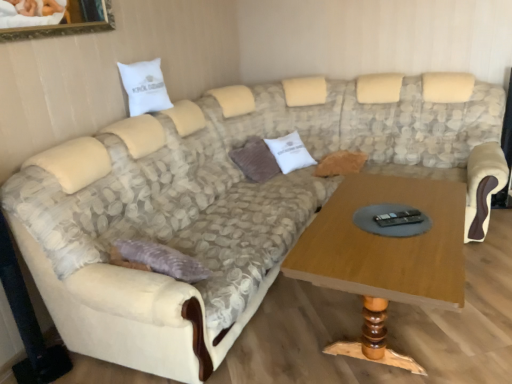
Where is `brown corduroy pillow at center, the second pillow viewed from the left`? This screenshot has width=512, height=384. brown corduroy pillow at center, the second pillow viewed from the left is located at coordinates (255, 160).

This screenshot has width=512, height=384. Describe the element at coordinates (290, 152) in the screenshot. I see `white cotton pillow at center, acting as the third pillow starting from the left` at that location.

The height and width of the screenshot is (384, 512). I want to click on brown corduroy pillow at center, which is the 2th pillow from right to left, so click(255, 160).

Is wooden coffee table at center facing away from white cotton pillow at upper left, the 1th pillow in the left-to-right sequence?

No, white cotton pillow at upper left, the 1th pillow in the left-to-right sequence, is not at the back of wooden coffee table at center.

From a real-world perspective, does wooden coffee table at center sit lower than white cotton pillow at upper left, the 1th pillow in the left-to-right sequence?

Yes, from a real-world perspective, wooden coffee table at center is below white cotton pillow at upper left, the 1th pillow in the left-to-right sequence.

Is point (446, 200) behind point (120, 72)?

No, (446, 200) is in front of (120, 72).

From the picture: Is brown corduroy pillow at center, the second pillow viewed from the left, to the left of wooden coffee table at center from the viewer's perspective?

Yes, brown corduroy pillow at center, the second pillow viewed from the left, is to the left of wooden coffee table at center.

Consider the image. Are brown corduroy pillow at center, which is the 2th pillow from right to left, and wooden coffee table at center located far from each other?

brown corduroy pillow at center, which is the 2th pillow from right to left, is positioned a significant distance from wooden coffee table at center.

Which is in front, brown corduroy pillow at center, the second pillow viewed from the left, or wooden coffee table at center?

wooden coffee table at center is more forward.

Can you confirm if brown corduroy pillow at center, the second pillow viewed from the left, is smaller than wooden coffee table at center?

Yes.

In terms of width, does white cotton pillow at center, which ranks as the first pillow in right-to-left order, look wider or thinner when compared to wooden coffee table at center?

In the image, white cotton pillow at center, which ranks as the first pillow in right-to-left order, appears to be more narrow than wooden coffee table at center.

Does white cotton pillow at center, which ranks as the first pillow in right-to-left order, touch wooden coffee table at center?

No, white cotton pillow at center, which ranks as the first pillow in right-to-left order, is not with wooden coffee table at center.

Which object is further away from the camera, white cotton pillow at center, acting as the third pillow starting from the left, or wooden coffee table at center?

white cotton pillow at center, acting as the third pillow starting from the left, is further from the camera.

Image resolution: width=512 pixels, height=384 pixels. Identify the location of the 1st pillow to the left of the wooden coffee table at center, counting from the anchor's position. (290, 152).

Consider the image. Does wooden coffee table at center touch white cotton pillow at center, acting as the third pillow starting from the left?

No, wooden coffee table at center is not making contact with white cotton pillow at center, acting as the third pillow starting from the left.

Is point (374, 261) farther from viewer compared to point (301, 145)?

No, it is in front of (301, 145).

Which object is positioned more to the right, wooden coffee table at center or white cotton pillow at center, which ranks as the first pillow in right-to-left order?

Positioned to the right is wooden coffee table at center.

Considering the relative sizes of wooden coffee table at center and white cotton pillow at center, which ranks as the first pillow in right-to-left order, in the image provided, is wooden coffee table at center bigger than white cotton pillow at center, which ranks as the first pillow in right-to-left order,?

Correct, wooden coffee table at center is larger in size than white cotton pillow at center, which ranks as the first pillow in right-to-left order.

Based on the photo, considering the relative sizes of white cotton pillow at upper left, the 1th pillow in the left-to-right sequence, and white cotton pillow at center, which ranks as the first pillow in right-to-left order, in the image provided, is white cotton pillow at upper left, the 1th pillow in the left-to-right sequence, taller than white cotton pillow at center, which ranks as the first pillow in right-to-left order,?

Incorrect, the height of white cotton pillow at upper left, the 1th pillow in the left-to-right sequence, is not larger of that of white cotton pillow at center, which ranks as the first pillow in right-to-left order.

Is white cotton pillow at upper left, the 1th pillow in the left-to-right sequence, not near white cotton pillow at center, which ranks as the first pillow in right-to-left order?

Yes, white cotton pillow at upper left, the 1th pillow in the left-to-right sequence, is far from white cotton pillow at center, which ranks as the first pillow in right-to-left order.

Is white cotton pillow at upper left, marked as the third pillow in a right-to-left arrangement, smaller than white cotton pillow at center, acting as the third pillow starting from the left?

Correct, white cotton pillow at upper left, marked as the third pillow in a right-to-left arrangement, occupies less space than white cotton pillow at center, acting as the third pillow starting from the left.

Looking at this image, from a real-world perspective, is wooden coffee table at center under brown corduroy pillow at center, which is the 2th pillow from right to left?

Yes.

From the image's perspective, which is above, wooden coffee table at center or brown corduroy pillow at center, which is the 2th pillow from right to left?

brown corduroy pillow at center, which is the 2th pillow from right to left, is shown above in the image.

Considering the relative positions of wooden coffee table at center and brown corduroy pillow at center, the second pillow viewed from the left, in the image provided, is wooden coffee table at center to the right of brown corduroy pillow at center, the second pillow viewed from the left, from the viewer's perspective?

Indeed, wooden coffee table at center is positioned on the right side of brown corduroy pillow at center, the second pillow viewed from the left.

Where is `coffee table that appears below the brown corduroy pillow at center, which is the 2th pillow from right to left (from the image's perspective)`? coffee table that appears below the brown corduroy pillow at center, which is the 2th pillow from right to left (from the image's perspective) is located at coordinates (385, 256).

From the image's perspective, is brown corduroy pillow at center, which is the 2th pillow from right to left, above or below white cotton pillow at upper left, the 1th pillow in the left-to-right sequence?

From the image's perspective, brown corduroy pillow at center, which is the 2th pillow from right to left, appears below white cotton pillow at upper left, the 1th pillow in the left-to-right sequence.

Is brown corduroy pillow at center, the second pillow viewed from the left, looking in the opposite direction of white cotton pillow at upper left, marked as the third pillow in a right-to-left arrangement?

brown corduroy pillow at center, the second pillow viewed from the left, does not have its back to white cotton pillow at upper left, marked as the third pillow in a right-to-left arrangement.

Does brown corduroy pillow at center, the second pillow viewed from the left, appear on the left side of white cotton pillow at upper left, the 1th pillow in the left-to-right sequence?

No.

Which pillow is the 1st one when counting from the back of the wooden coffee table at center? Please provide its 2D coordinates.

[(144, 87)]

Where is `coffee table in front of the brown corduroy pillow at center, which is the 2th pillow from right to left`? The width and height of the screenshot is (512, 384). coffee table in front of the brown corduroy pillow at center, which is the 2th pillow from right to left is located at coordinates (385, 256).

Consider the image. Estimate the real-world distances between objects in this image. Which object is further from white cotton pillow at center, which ranks as the first pillow in right-to-left order, wooden coffee table at center or white cotton pillow at upper left, marked as the third pillow in a right-to-left arrangement?

Based on the image, wooden coffee table at center appears to be further to white cotton pillow at center, which ranks as the first pillow in right-to-left order.

Which object lies further to the anchor point white cotton pillow at center, acting as the third pillow starting from the left, brown corduroy pillow at center, which is the 2th pillow from right to left, or white cotton pillow at upper left, the 1th pillow in the left-to-right sequence?

Based on the image, white cotton pillow at upper left, the 1th pillow in the left-to-right sequence, appears to be further to white cotton pillow at center, acting as the third pillow starting from the left.

When comparing their distances from white cotton pillow at upper left, marked as the third pillow in a right-to-left arrangement, does brown corduroy pillow at center, the second pillow viewed from the left, or white cotton pillow at center, which ranks as the first pillow in right-to-left order, seem further?

white cotton pillow at center, which ranks as the first pillow in right-to-left order, is positioned further to the anchor white cotton pillow at upper left, marked as the third pillow in a right-to-left arrangement.

From the image, which object appears to be farther from wooden coffee table at center, brown corduroy pillow at center, which is the 2th pillow from right to left, or white cotton pillow at upper left, the 1th pillow in the left-to-right sequence?

The object further to wooden coffee table at center is white cotton pillow at upper left, the 1th pillow in the left-to-right sequence.

In the scene shown: Considering their positions, is wooden coffee table at center positioned further to brown corduroy pillow at center, which is the 2th pillow from right to left, than white cotton pillow at upper left, the 1th pillow in the left-to-right sequence?

wooden coffee table at center.

Looking at the image, which one is located closer to white cotton pillow at center, which ranks as the first pillow in right-to-left order, white cotton pillow at upper left, marked as the third pillow in a right-to-left arrangement, or brown corduroy pillow at center, which is the 2th pillow from right to left?

brown corduroy pillow at center, which is the 2th pillow from right to left.

Considering their positions, is white cotton pillow at center, acting as the third pillow starting from the left, positioned further to white cotton pillow at upper left, marked as the third pillow in a right-to-left arrangement, than brown corduroy pillow at center, which is the 2th pillow from right to left?

white cotton pillow at center, acting as the third pillow starting from the left, lies further to white cotton pillow at upper left, marked as the third pillow in a right-to-left arrangement, than the other object.

When comparing their distances from white cotton pillow at upper left, marked as the third pillow in a right-to-left arrangement, does white cotton pillow at center, acting as the third pillow starting from the left, or wooden coffee table at center seem further?

The object further to white cotton pillow at upper left, marked as the third pillow in a right-to-left arrangement, is wooden coffee table at center.

Identify the location of pillow between wooden coffee table at center and brown corduroy pillow at center, the second pillow viewed from the left, along the z-axis. (144, 87).

Identify the location of pillow between white cotton pillow at upper left, the 1th pillow in the left-to-right sequence, and white cotton pillow at center, which ranks as the first pillow in right-to-left order, in the horizontal direction. The width and height of the screenshot is (512, 384). (255, 160).